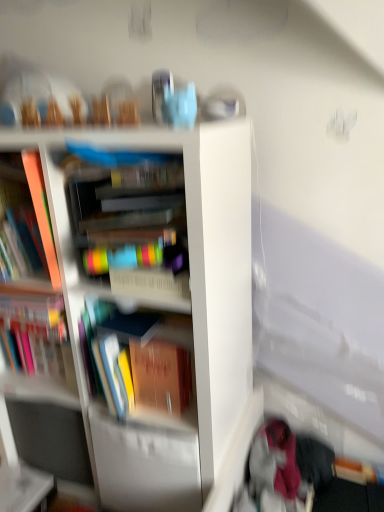
Question: Is velvet pink scarf at lower right wider or thinner than multicolored plastic container at center, acting as the 4th book starting from the left?

Choices:
 (A) thin
 (B) wide

Answer: (A)

Question: Visually, is velvet pink scarf at lower right positioned to the left or to the right of multicolored plastic container at center, acting as the 4th book starting from the left?

Choices:
 (A) left
 (B) right

Answer: (B)

Question: Estimate the real-world distances between objects in this image. Which object is closer to the matte orange book at left, marked as the 3th book in a right-to-left arrangement?

Choices:
 (A) hardcover book at left, which is the first book in left-to-right order
 (B) white glossy bookcase at center
 (C) multicolored plastic container at center, acting as the 4th book starting from the left
 (D) hardcover book at center, which appears as the third book when viewed from the left
 (E) white glossy table at lower left

Answer: (D)

Question: Estimate the real-world distances between objects in this image. Which object is closer to the multicolored plastic container at center, acting as the 4th book starting from the left?

Choices:
 (A) white glossy bookcase at center
 (B) hardcover book at center, which appears as the third book when viewed from the left
 (C) velvet pink scarf at lower right
 (D) matte orange book at left, marked as the 3th book in a right-to-left arrangement
 (E) white glossy table at lower left

Answer: (A)